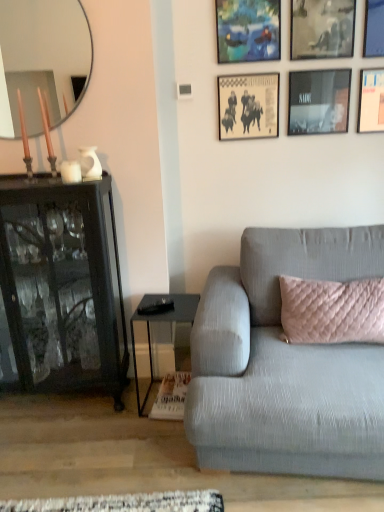
Question: In which direction should I rotate to look at blue textured fabric picture frame at upper center, the 1th picture frame in the left-to-right sequence?

Choices:
 (A) left
 (B) right

Answer: (B)

Question: Is metallic silver picture frame at upper right, positioned as the sixth picture frame in left-to-right order, smaller than black glossy picture frame at upper right, the 4th picture frame from the left?

Choices:
 (A) no
 (B) yes

Answer: (A)

Question: Considering the relative sizes of metallic silver picture frame at upper right, positioned as the sixth picture frame in left-to-right order, and black glossy picture frame at upper right, the 4th picture frame from the left, in the image provided, is metallic silver picture frame at upper right, positioned as the sixth picture frame in left-to-right order, thinner than black glossy picture frame at upper right, the 4th picture frame from the left,?

Choices:
 (A) no
 (B) yes

Answer: (A)

Question: Is metallic silver picture frame at upper right, positioned as the sixth picture frame in left-to-right order, closer to camera compared to black glossy picture frame at upper right, the 4th picture frame from the left?

Choices:
 (A) no
 (B) yes

Answer: (B)

Question: Is the surface of metallic silver picture frame at upper right, the 1th picture frame in the right-to-left sequence, in direct contact with black glossy picture frame at upper right, which appears as the third picture frame when viewed from the right?

Choices:
 (A) no
 (B) yes

Answer: (A)

Question: Is black glossy picture frame at upper right, the 4th picture frame from the left, inside metallic silver picture frame at upper right, positioned as the sixth picture frame in left-to-right order?

Choices:
 (A) no
 (B) yes

Answer: (A)

Question: Is metallic silver picture frame at upper right, the 1th picture frame in the right-to-left sequence, taller than black glossy picture frame at upper right, which appears as the third picture frame when viewed from the right?

Choices:
 (A) no
 (B) yes

Answer: (A)

Question: Can you confirm if black glass cabinet at left is thinner than black plastic remote control at lower center?

Choices:
 (A) yes
 (B) no

Answer: (B)

Question: From the image's perspective, would you say black glass cabinet at left is positioned over black plastic remote control at lower center?

Choices:
 (A) no
 (B) yes

Answer: (B)

Question: Can you confirm if black glass cabinet at left is positioned to the left of black plastic remote control at lower center?

Choices:
 (A) no
 (B) yes

Answer: (B)

Question: Is the depth of black glass cabinet at left greater than that of black plastic remote control at lower center?

Choices:
 (A) yes
 (B) no

Answer: (B)

Question: Is the position of black glass cabinet at left less distant than that of black plastic remote control at lower center?

Choices:
 (A) yes
 (B) no

Answer: (A)

Question: Is black glass cabinet at left oriented towards black plastic remote control at lower center?

Choices:
 (A) no
 (B) yes

Answer: (A)

Question: Is beige paper picture frame at upper center, the second picture frame from the left, at the right side of blue textured fabric picture frame at upper center, the 1th picture frame in the left-to-right sequence?

Choices:
 (A) yes
 (B) no

Answer: (A)